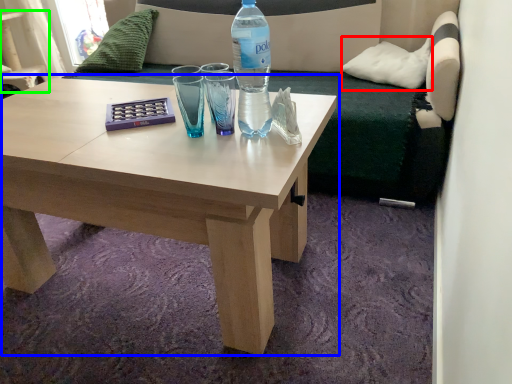
Question: Which object is positioned farthest from pillow (highlighted by a red box)? Select from coffee table (highlighted by a blue box) and armchair (highlighted by a green box).

Choices:
 (A) coffee table
 (B) armchair

Answer: (B)